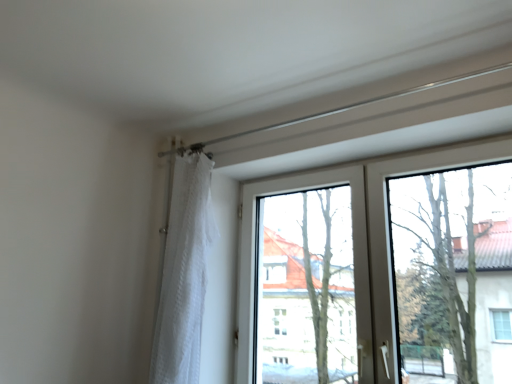
Question: In terms of height, does transparent glass window at center look taller or shorter compared to transparent glass tree at upper right?

Choices:
 (A) short
 (B) tall

Answer: (B)

Question: Which is correct: transparent glass window at center is inside transparent glass tree at upper right, or outside of it?

Choices:
 (A) outside
 (B) inside

Answer: (A)

Question: Estimate the real-world distances between objects in this image. Which object is closer to the transparent glass tree at upper right?

Choices:
 (A) transparent glass window at center
 (B) white sheer curtain at left

Answer: (A)

Question: Which of these objects is positioned closest to the white sheer curtain at left?

Choices:
 (A) transparent glass window at center
 (B) transparent glass tree at upper right

Answer: (A)